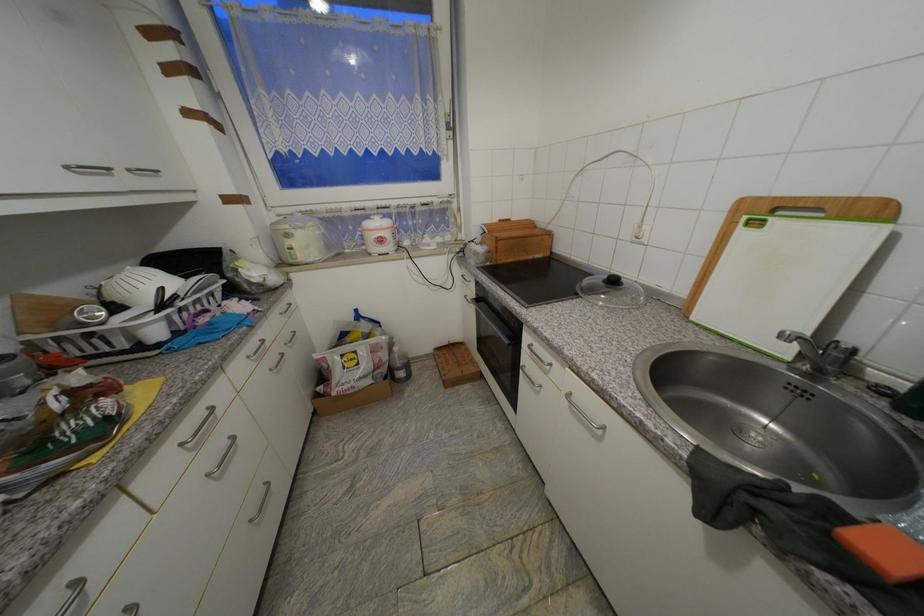
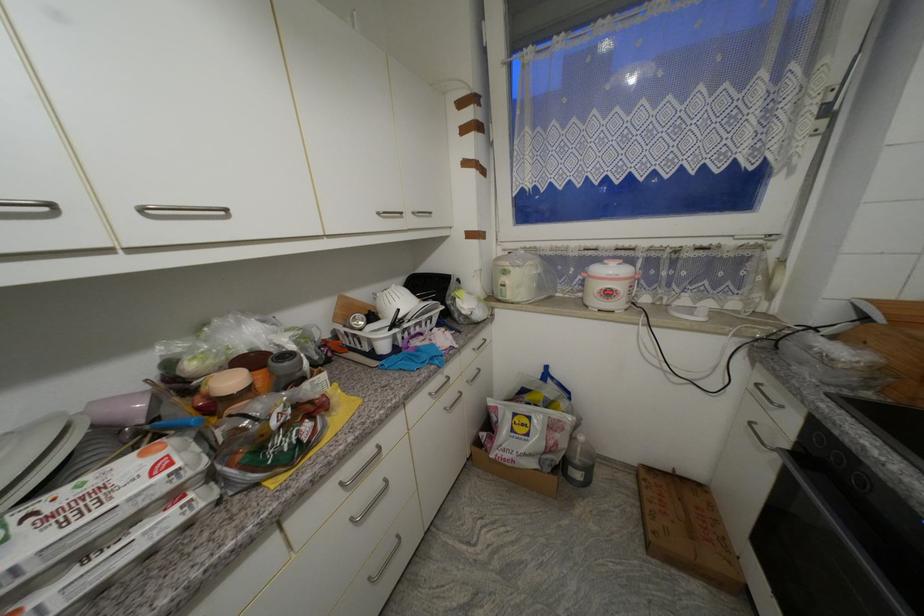
The point at (74,169) is marked in the first image. Where is the corresponding point in the second image?

(383, 215)